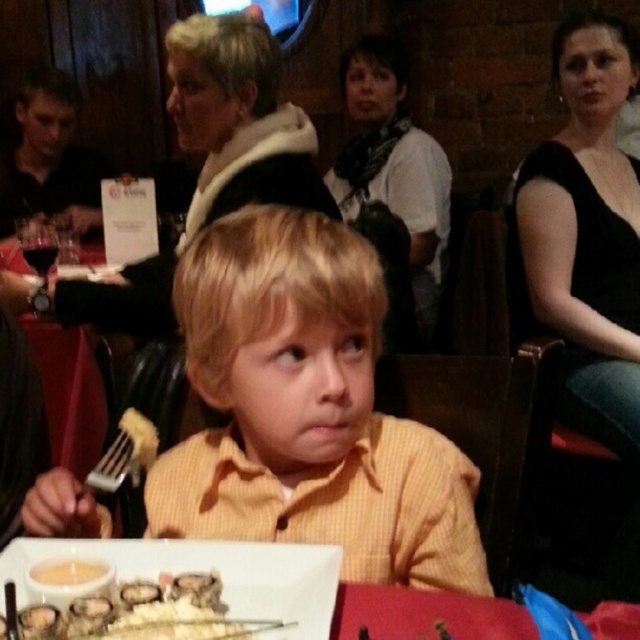
What do you see at coordinates (307, 412) in the screenshot? I see `yellow striped shirt at center` at bounding box center [307, 412].

Where is `yellow striped shirt at center`? This screenshot has width=640, height=640. yellow striped shirt at center is located at coordinates (307, 412).

Between white ceramic plate at lower center and yellow cheese at lower left, which one is positioned lower?

Positioned lower is white ceramic plate at lower center.

Which is in front, point (301, 580) or point (81, 563)?

Point (81, 563) is in front.

You are a GUI agent. You are given a task and a screenshot of the screen. Output one action in this format:
    pyautogui.click(x=<x>, y=<y>)
    Task: Click on the white ceramic plate at lower center
    This screenshot has height=640, width=640.
    Given the screenshot: What is the action you would take?
    [x=284, y=588]

Between yellow striped shirt at center and white ceramic plate at lower center, which one appears on the right side from the viewer's perspective?

Positioned to the right is yellow striped shirt at center.

Between point (237, 428) and point (308, 588), which one is positioned in front?

Point (308, 588) is more forward.

You are a GUI agent. You are given a task and a screenshot of the screen. Output one action in this format:
    pyautogui.click(x=<x>, y=<y>)
    Task: Click on the yellow striped shirt at center
    This screenshot has height=640, width=640.
    Given the screenshot: What is the action you would take?
    pyautogui.click(x=307, y=412)